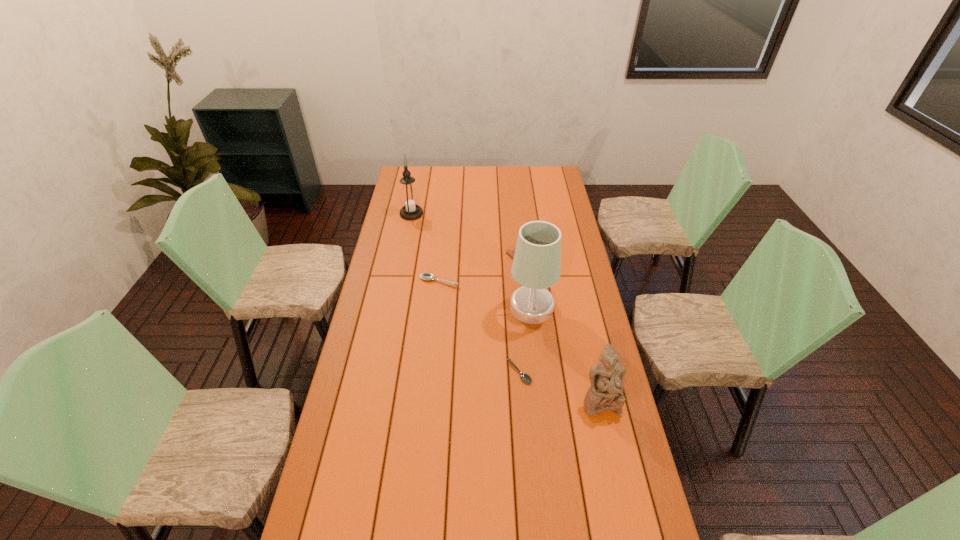
This screenshot has width=960, height=540. What are the coordinates of `the farther soupspoon` in the screenshot? It's located at (427, 276).

Identify the location of the third farthest object. This screenshot has height=540, width=960. (427, 276).

At what (x,y) coordinates should I click in order to perform the action: click on the right soupspoon. Please return your answer as a coordinate pair (x, y). Image resolution: width=960 pixels, height=540 pixels. Looking at the image, I should click on (526, 378).

Where is `the shorter soupspoon`? This screenshot has height=540, width=960. the shorter soupspoon is located at coordinates (526, 378).

Identify the location of the fifth nearest object. This screenshot has width=960, height=540. (511, 251).

Locate an element on the screen. The image size is (960, 540). the third nearest object is located at coordinates (536, 265).

The image size is (960, 540). I want to click on the farthest object, so click(x=409, y=198).

Find the location of a particular element. the leftmost object is located at coordinates (409, 198).

You are a GUI agent. You are given a task and a screenshot of the screen. Output one action in this format:
    pyautogui.click(x=<x>, y=<y>)
    Task: Click on the fourth shortest object
    This screenshot has height=540, width=960.
    Given the screenshot: What is the action you would take?
    pyautogui.click(x=606, y=378)

Locate an element on the screen. The height and width of the screenshot is (540, 960). the rightmost object is located at coordinates (606, 378).